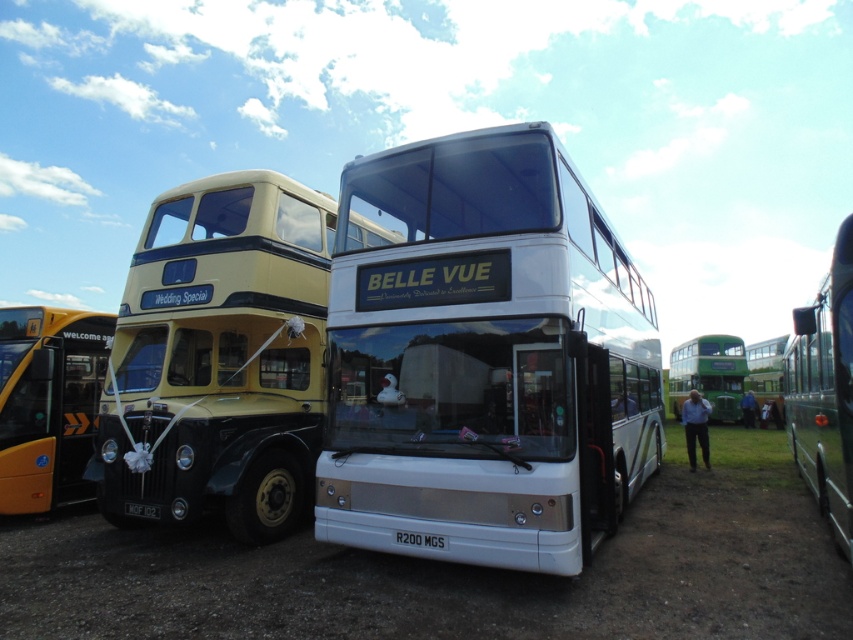
Question: Which object is closer to the camera taking this photo?

Choices:
 (A) black plastic license plate at center
 (B) green metallic bus at right
 (C) yellow matte double-decker bus at left

Answer: (B)

Question: Which of the following is the closest to the observer?

Choices:
 (A) green matte bus at right
 (B) yellow metallic bus at left
 (C) green matte bus at upper right

Answer: (B)

Question: Considering the real-world distances, which object is farthest from the yellow metallic bus at left?

Choices:
 (A) green matte bus at right
 (B) yellow matte double-decker bus at left
 (C) white plastic license plate at center

Answer: (A)

Question: Can you confirm if white glossy double-decker bus at center is positioned to the left of black plastic license plate at center?

Choices:
 (A) yes
 (B) no

Answer: (B)

Question: Is white glossy double-decker bus at center closer to the viewer compared to black plastic license plate at center?

Choices:
 (A) yes
 (B) no

Answer: (A)

Question: Does white glossy double-decker bus at center appear on the right side of yellow metallic bus at left?

Choices:
 (A) yes
 (B) no

Answer: (A)